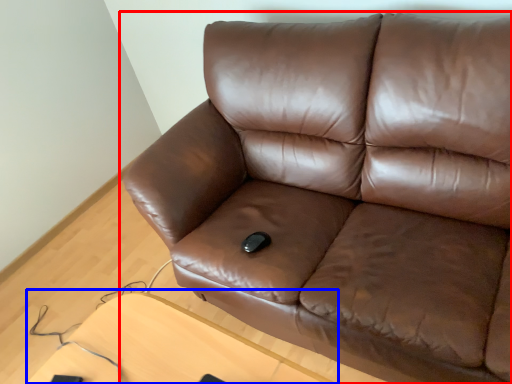
Question: Which of the following is the farthest to the observer, studio couch (highlighted by a red box) or table (highlighted by a blue box)?

Choices:
 (A) studio couch
 (B) table

Answer: (B)